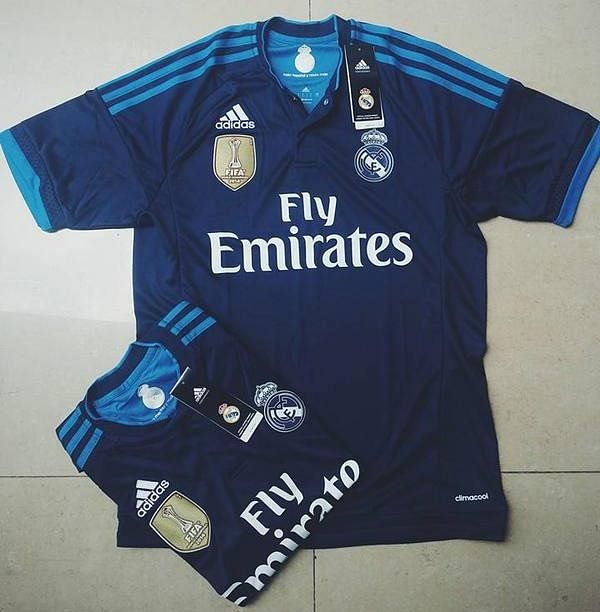
At what (x,y) coordinates should I click in order to perform the action: click on greyish, white tile background. Please return your answer as a coordinate pair (x, y). This screenshot has height=612, width=600. Looking at the image, I should click on 56,39.